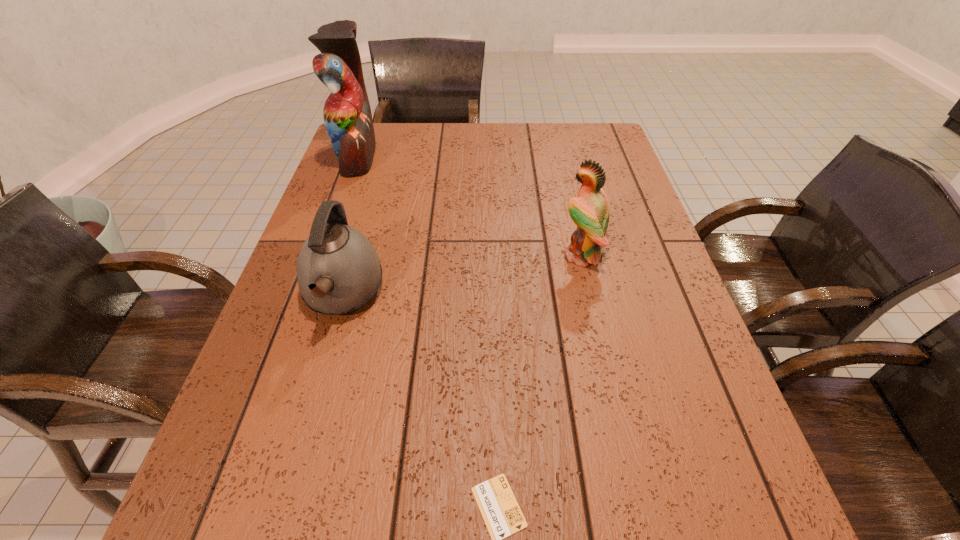
This screenshot has height=540, width=960. I want to click on object that is at the far edge, so click(347, 115).

At what (x,y) coordinates should I click in order to perform the action: click on parrot situated at the left edge. Please return your answer as a coordinate pair (x, y). Image resolution: width=960 pixels, height=540 pixels. Looking at the image, I should click on (347, 115).

In order to click on kettle at the left edge in this screenshot , I will do `click(338, 270)`.

The height and width of the screenshot is (540, 960). I want to click on object that is at the right edge, so click(x=589, y=211).

You are a GUI agent. You are given a task and a screenshot of the screen. Output one action in this format:
    pyautogui.click(x=<x>, y=<y>)
    Task: Click on the object at the far left corner
    
    Given the screenshot: What is the action you would take?
    coord(347,115)

Find the location of `free region at the far edge of the desktop`. free region at the far edge of the desktop is located at coordinates (421, 145).

Image resolution: width=960 pixels, height=540 pixels. In the image, there is a desktop. Find the location of `vacant space at the left edge`. vacant space at the left edge is located at coordinates (209, 465).

In the image, there is a desktop. Identify the location of vacant space at the right edge. The height and width of the screenshot is (540, 960). (684, 390).

Where is `vacant space at the far left corner of the desktop`? vacant space at the far left corner of the desktop is located at coordinates (382, 159).

Where is `free space between the third tallest object and the right parrot`? This screenshot has width=960, height=540. free space between the third tallest object and the right parrot is located at coordinates (462, 275).